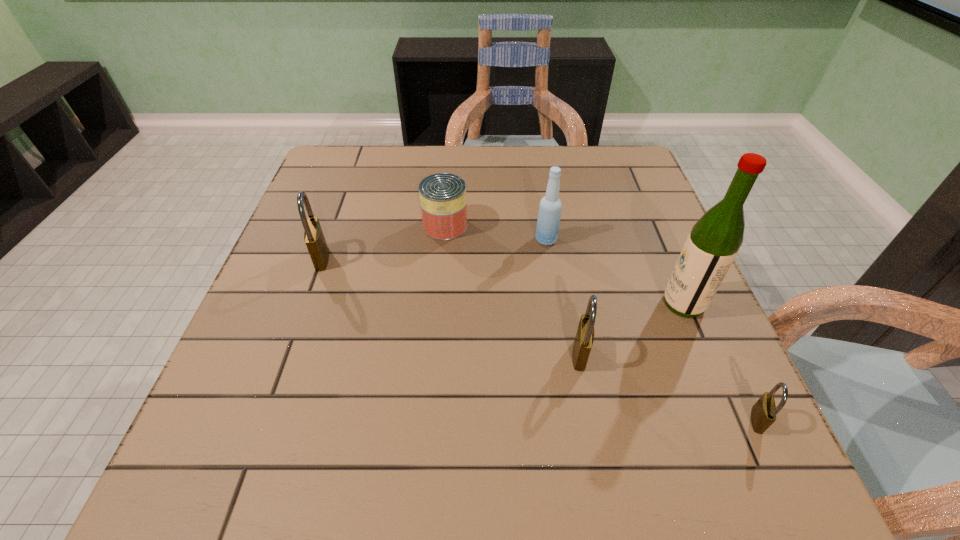
Where is `the leftmost object`? the leftmost object is located at coordinates (314, 238).

At what (x,y) coordinates should I click in order to perform the action: click on the farthest padlock. Please return your answer as a coordinate pair (x, y). This screenshot has height=540, width=960. Looking at the image, I should click on (314, 238).

This screenshot has height=540, width=960. I want to click on the second tallest padlock, so click(x=584, y=338).

Locate an element on the screen. the second padlock from left to right is located at coordinates (584, 338).

The height and width of the screenshot is (540, 960). What are the coordinates of `the shortest padlock` in the screenshot? It's located at (763, 414).

Find the location of a particular element. This screenshot has width=960, height=540. the rightmost padlock is located at coordinates pos(763,414).

The image size is (960, 540). Identify the location of bottle. (550, 207).

Where is `the fifth object from right to left`? This screenshot has width=960, height=540. the fifth object from right to left is located at coordinates (443, 202).

Locate an element on the screen. The width and height of the screenshot is (960, 540). liquor is located at coordinates (714, 241).

At what (x,y) coordinates should I click in order to perform the action: click on the tallest object. Please return your answer as a coordinate pair (x, y). The image size is (960, 540). Looking at the image, I should click on (714, 241).